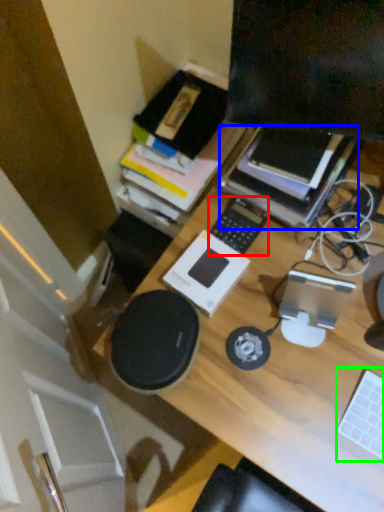
Question: Estimate the real-world distances between objects in this image. Which object is closer to laptop keyboard (highlighted by a red box), paperback book (highlighted by a blue box) or laptop keyboard (highlighted by a green box)?

Choices:
 (A) paperback book
 (B) laptop keyboard

Answer: (A)